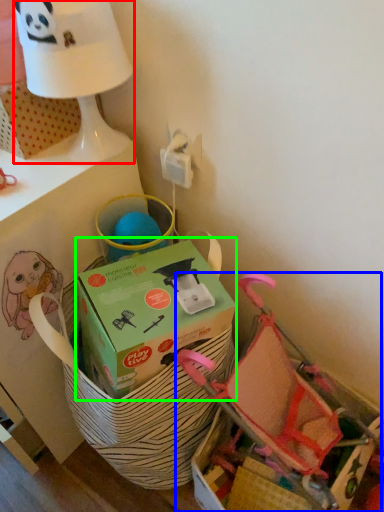
Question: Estimate the real-world distances between objects in this image. Which object is farther from table lamp (highlighted by a red box), baby carriage (highlighted by a blue box) or box (highlighted by a green box)?

Choices:
 (A) baby carriage
 (B) box

Answer: (A)